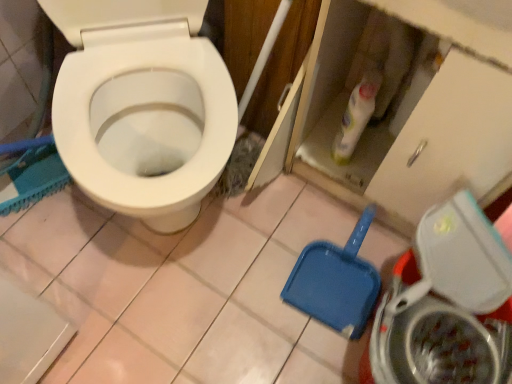
This screenshot has width=512, height=384. In order to click on free point below blue plastic shovel at lower right (from a real-world perspective) in this screenshot , I will do `click(340, 269)`.